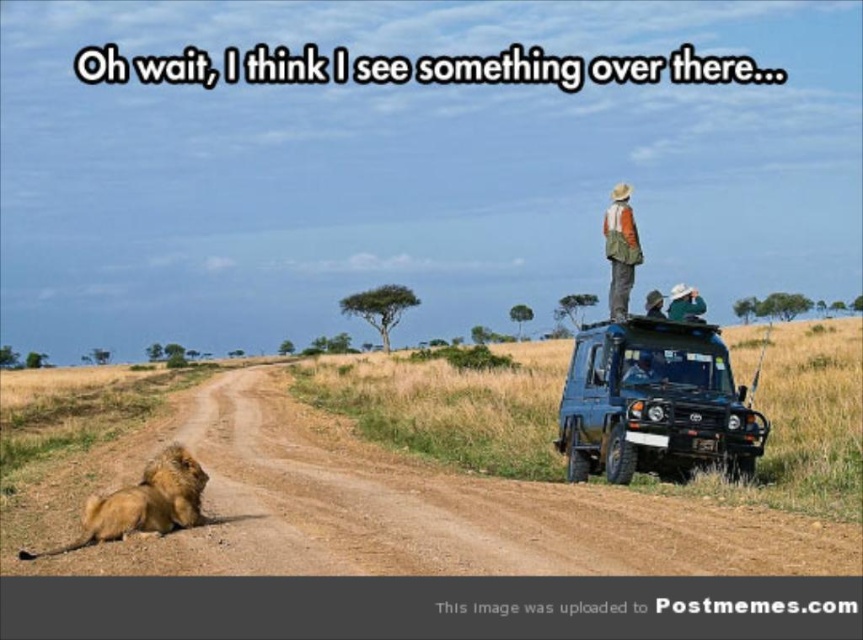
You are standing at the point marked as point (654,364) in the savanna scene. The dark blue safari vehicle is parked on the right side of the road. Can you see the safari vehicle from your current position?

The distance between point (654,364) and the viewer is 149.16 feet. Since the safari vehicle is parked on the right side of the road in the foreground, it is likely within this distance, so you can see the safari vehicle from your current position.

You are a photographer trying to capture a photo of the green fabric hat at upper center without the blue matte suv at right blocking the view. Given their sizes, can you position yourself so that the suv is entirely out of the frame while keeping the hat in view?

The blue matte suv at right has a smaller size compared to green fabric hat at upper center. Since the suv is smaller, it would occupy less space in the frame. By positioning yourself closer to the hat or angling the camera so that the suv is outside the frame, you can likely capture the hat without the suv obstructing the view.